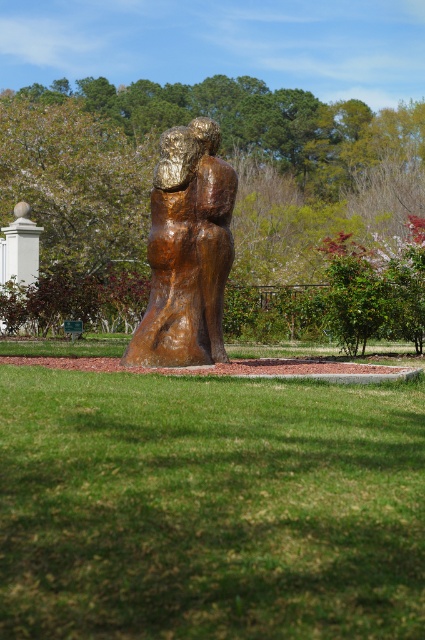
Consider the image. You are standing in front of the bronze sculpture in the park. You notice two points marked on the sculpture. The first point is at coordinate point (390, 180) and the second is at point (172, 305). If you were to walk towards the sculpture, which point would appear closer to you?

Point (390, 180) is further to the viewer than point (172, 305), so the first point would appear closer to you.

You are standing in the park and want to take a photo of both the green grass at center and the green leafy tree at center. Which object should you focus on first to ensure both are in sharp focus?

You should focus on the green leafy tree at center first because it is farther away from the viewer than the green grass at center, ensuring both are in focus with proper depth of field.